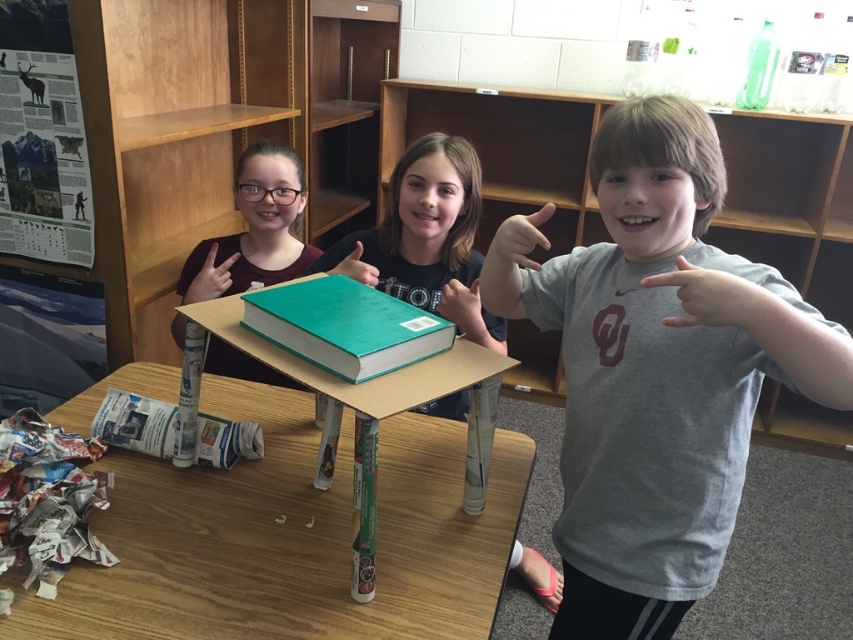
Question: Can you confirm if smooth gray hand at center is smaller than matte gray finger at upper right?

Choices:
 (A) no
 (B) yes

Answer: (B)

Question: Is green hardcover book at center wider than smooth gray hand at center?

Choices:
 (A) no
 (B) yes

Answer: (B)

Question: Which object is farther from the camera taking this photo?

Choices:
 (A) green cardboard bookshelf at upper center
 (B) green cardboard table at center
 (C) matte green book at center
 (D) green hardcover book at center

Answer: (A)

Question: Which point is farther from the camera taking this photo?

Choices:
 (A) (347, 259)
 (B) (480, 339)

Answer: (B)

Question: From the image, what is the correct spatial relationship of white cardboard book at lower left in relation to smooth gray hand at center?

Choices:
 (A) below
 (B) above

Answer: (A)

Question: Which of these objects is positioned closest to the green cardboard table at center?

Choices:
 (A) gray cotton t-shirt at center
 (B) green matte book at center
 (C) matte green book at center

Answer: (A)